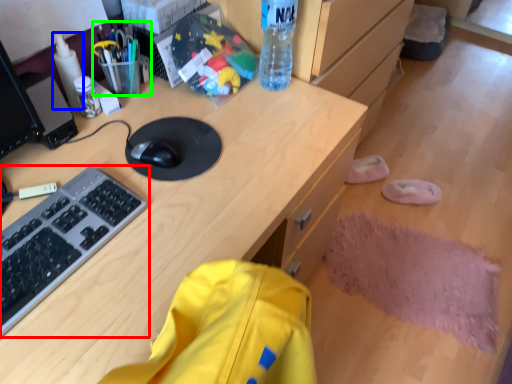
Question: Which object is the closest to the computer keyboard (highlighted by a red box)? Choose among these: bottle (highlighted by a blue box) or stationery (highlighted by a green box).

Choices:
 (A) bottle
 (B) stationery

Answer: (A)